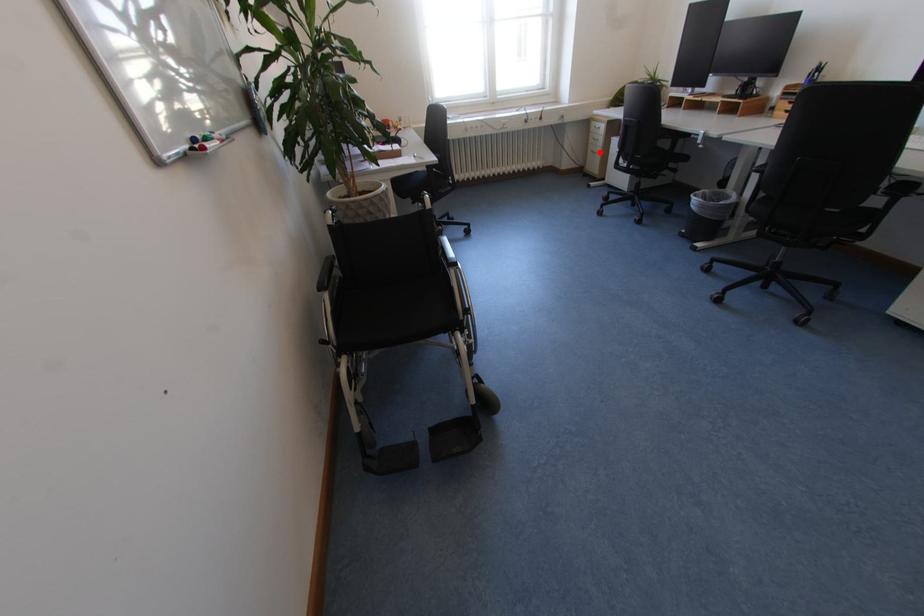
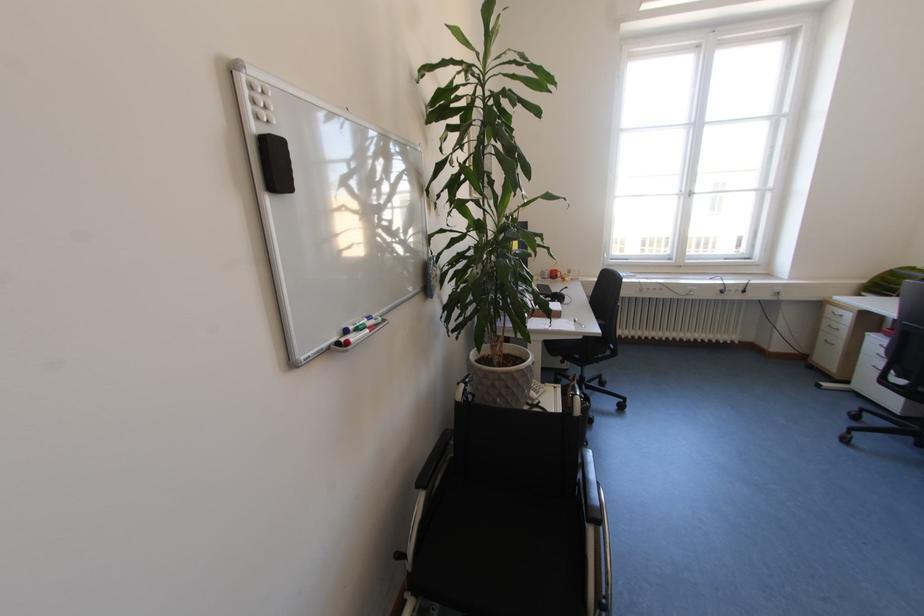
Where in the second image is the point corresponding to the highlighted location from the first image?

(833, 342)